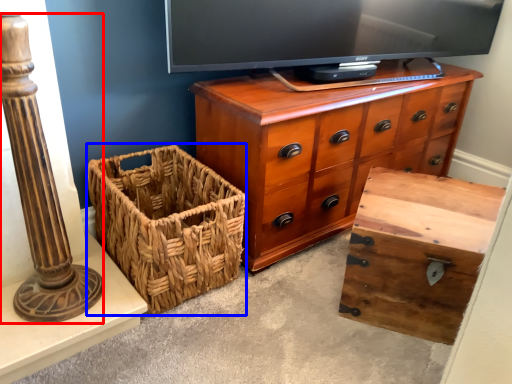
Question: Which of the following is the farthest to the observer, pillar (highlighted by a red box) or basket (highlighted by a blue box)?

Choices:
 (A) pillar
 (B) basket

Answer: (B)